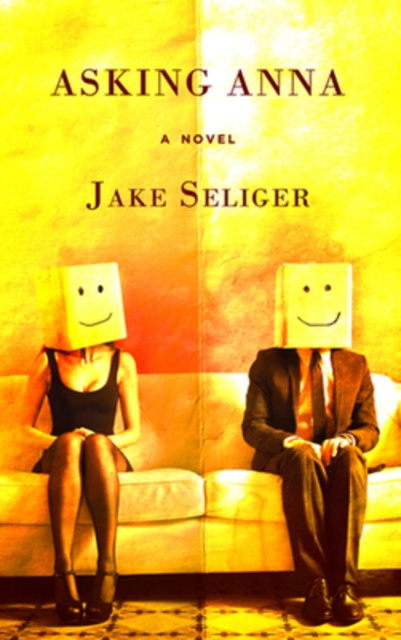
Does matte black dress at left appear over yellow matte square at center?

No, matte black dress at left is not above yellow matte square at center.

Who is positioned more to the right, matte black dress at left or yellow matte square at center?

Positioned to the right is yellow matte square at center.

Which is in front, point (42, 380) or point (346, 285)?

Point (42, 380) is more forward.

Where is `matte black dress at left`? matte black dress at left is located at coordinates (83, 419).

Does matte brown suit at center have a lesser width compared to yellow matte square at center?

In fact, matte brown suit at center might be wider than yellow matte square at center.

Which is behind, point (322, 410) or point (285, 317)?

Point (285, 317)

Find the location of a particular element. The height and width of the screenshot is (640, 401). matte brown suit at center is located at coordinates (315, 432).

Does point (0, 410) come closer to viewer compared to point (330, 512)?

No, (0, 410) is further to viewer.

The image size is (401, 640). What are the coordinates of `beige fabric couch at center` in the screenshot? It's located at (200, 492).